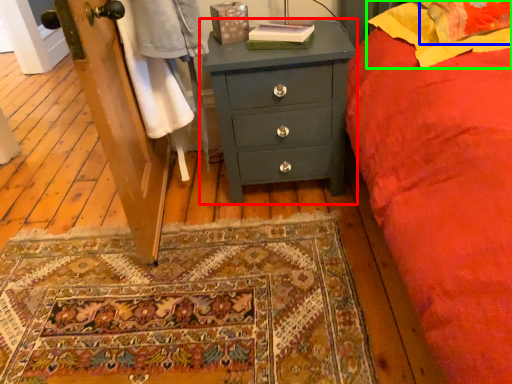
Question: Which object is the closest to the chest of drawers (highlighted by a red box)? Choose among these: pillow (highlighted by a blue box) or pillow (highlighted by a green box).

Choices:
 (A) pillow
 (B) pillow

Answer: (B)